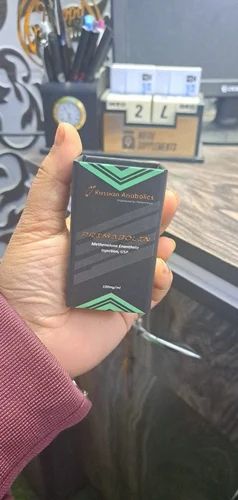
This screenshot has height=500, width=238. Find the location of `monitor frame - bottom`. monitor frame - bottom is located at coordinates (226, 87).